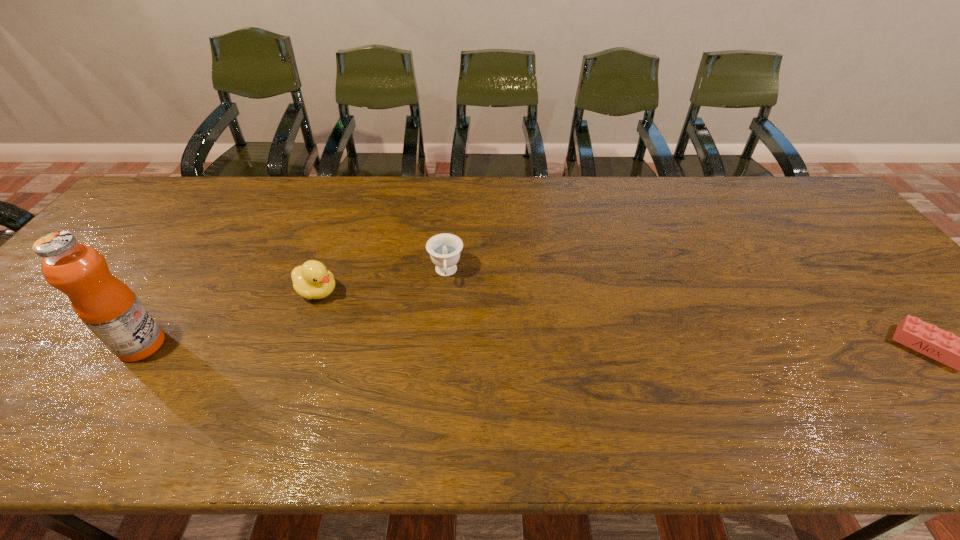
Locate an element on the screen. Image resolution: width=960 pixels, height=540 pixels. the tallest object is located at coordinates (109, 308).

Locate an element on the screen. fruit juice is located at coordinates (109, 308).

The width and height of the screenshot is (960, 540). Identify the location of duckling. (312, 280).

Find the location of a particular element. The image size is (960, 540). the third object from right to left is located at coordinates [x=312, y=280].

The width and height of the screenshot is (960, 540). I want to click on the third object from left to right, so click(x=444, y=249).

Identify the location of teacup. (444, 249).

Where is `vacant space situated on the back of the leftmost object`? The width and height of the screenshot is (960, 540). vacant space situated on the back of the leftmost object is located at coordinates (203, 253).

Find the location of a particular element. The height and width of the screenshot is (540, 960). free space located 0.350m on the beak of the third object from right to left is located at coordinates (x=447, y=357).

You are a GUI agent. You are given a task and a screenshot of the screen. Output one action in this format:
    pyautogui.click(x=<x>, y=<y>)
    Task: Click on the blank space located 0.300m on the beak of the third object from right to left
    This screenshot has height=540, width=960.
    Given the screenshot: What is the action you would take?
    pyautogui.click(x=429, y=348)

The image size is (960, 540). In order to click on vacant space positioned 0.400m on the beak of the third object from right to left in this screenshot , I will do `click(467, 366)`.